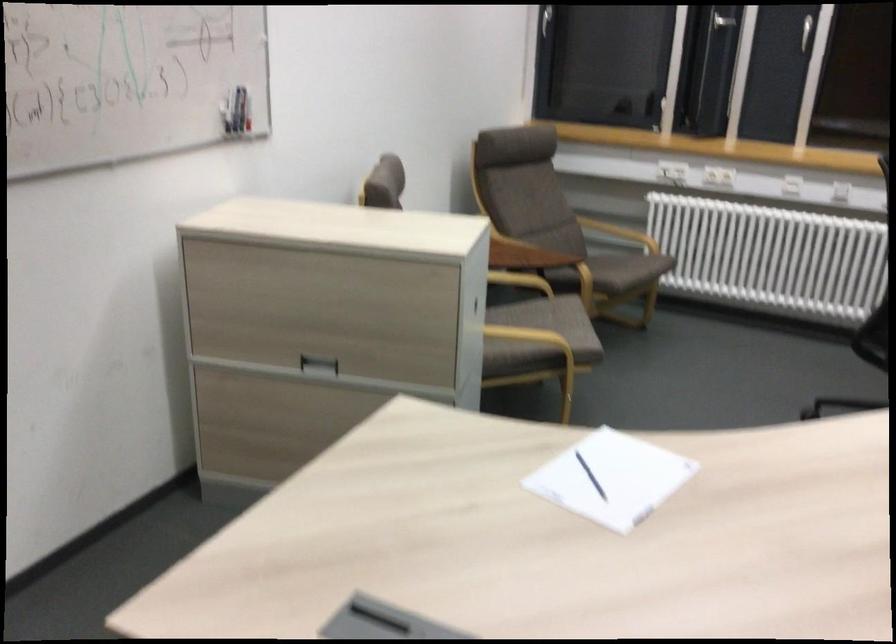
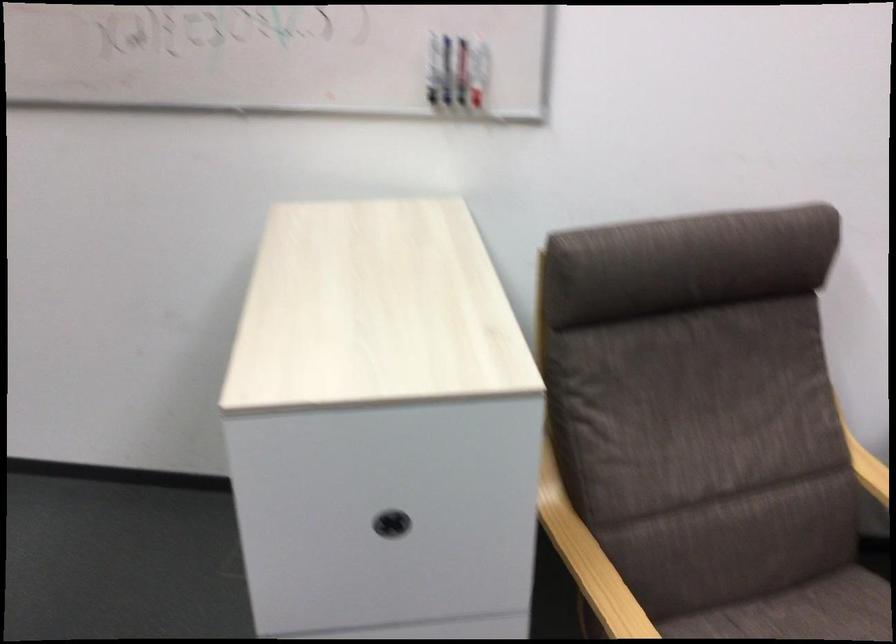
In the second image, find the point that corresponds to [472,304] in the first image.

(391, 524)